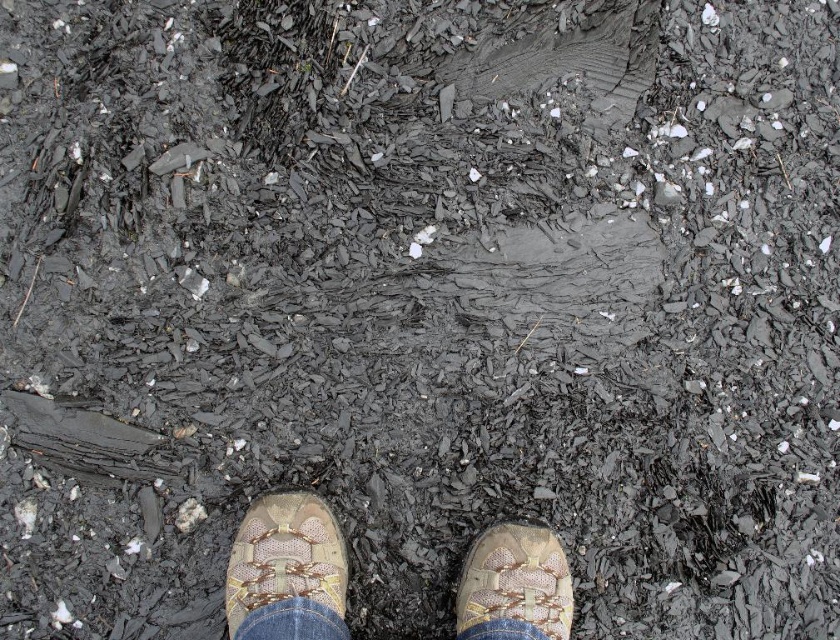
From the picture: Is tan mesh shoes at center wider than tan suede shoe at lower center?

Yes.

What do you see at coordinates (286, 570) in the screenshot? Image resolution: width=840 pixels, height=640 pixels. I see `tan mesh shoes at center` at bounding box center [286, 570].

I want to click on tan mesh shoes at center, so click(286, 570).

From the picture: Is tan mesh shoes at center positioned in front of tan suede sandal at center?

Yes.

Between tan mesh shoes at center and tan suede sandal at center, which one appears on the left side from the viewer's perspective?

tan mesh shoes at center

What are the coordinates of `tan mesh shoes at center` in the screenshot? It's located at (286, 570).

Who is positioned more to the left, tan suede shoe at lower center or tan suede sandal at center?

From the viewer's perspective, tan suede shoe at lower center appears more on the left side.

Is point (329, 515) farther from camera compared to point (522, 589)?

Yes, it is.

Describe the element at coordinates (285, 556) in the screenshot. I see `tan suede shoe at lower center` at that location.

Identify the location of tan suede shoe at lower center. Image resolution: width=840 pixels, height=640 pixels. (285, 556).